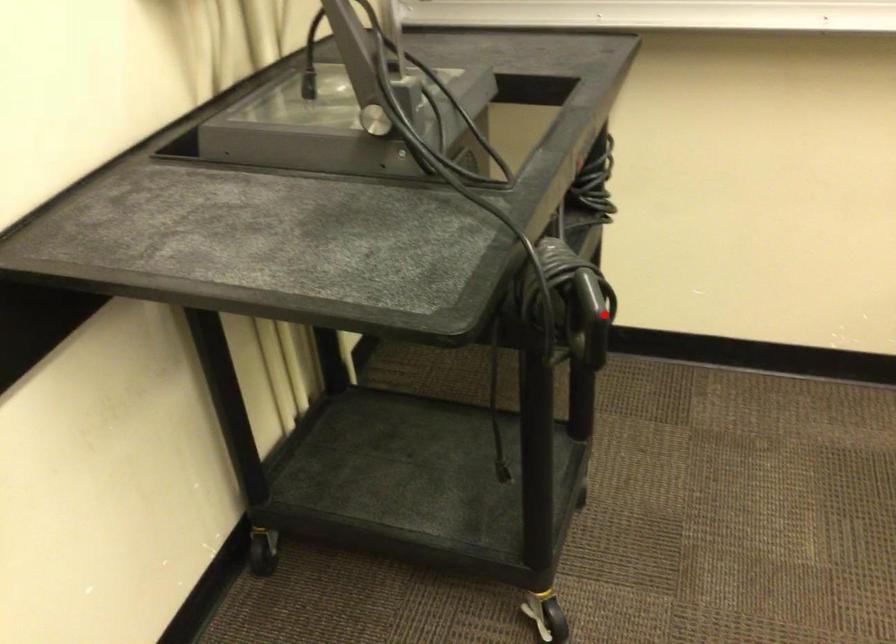
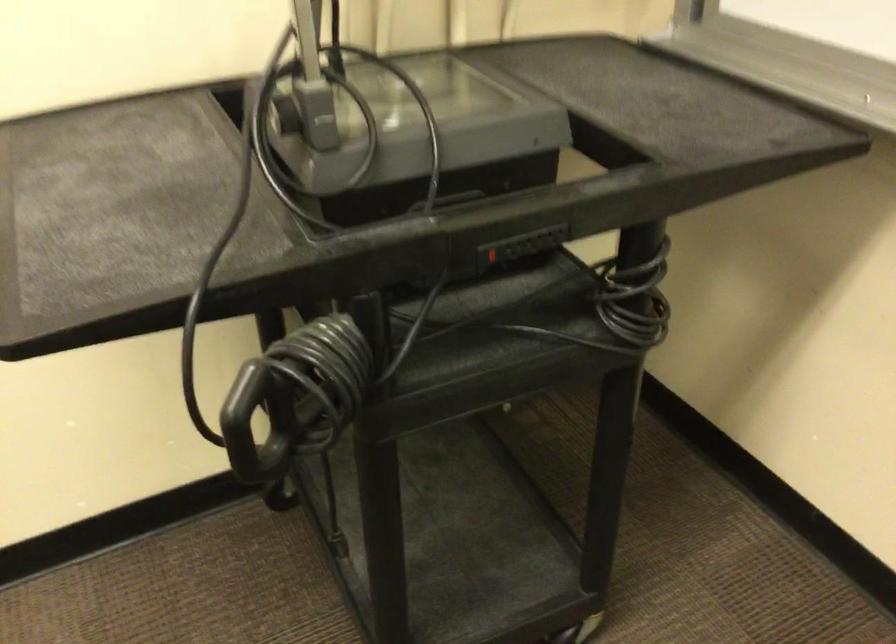
Question: I am providing you with two images of the same scene from different viewpoints. In image1, a red point is highlighted. Considering the same 3D point in image2, which of the following is correct?

Choices:
 (A) It is closer
 (B) It is farther

Answer: (A)